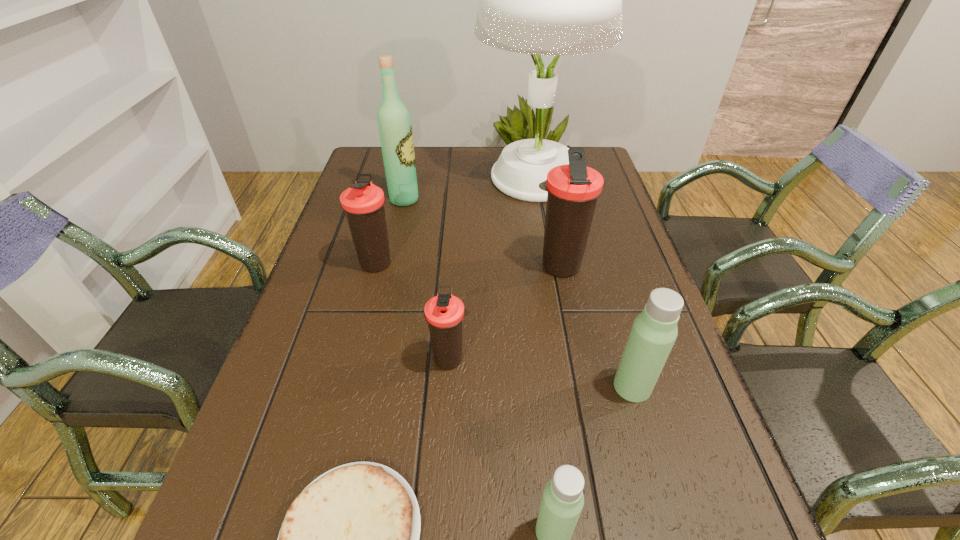
At what (x,y) coordinates should I click in order to perform the action: click on the tallest object. Please return your answer as a coordinate pair (x, y). Image resolution: width=960 pixels, height=540 pixels. Looking at the image, I should click on (556, 0).

You are a GUI agent. You are given a task and a screenshot of the screen. Output one action in this format:
    pyautogui.click(x=<x>, y=<y>)
    Task: Click on the lamp
    The image size is (960, 540).
    Given the screenshot: What is the action you would take?
    pyautogui.click(x=556, y=0)

Identify the location of the seventh shortest object. The width and height of the screenshot is (960, 540). (395, 129).

Find the location of a particular element. The width and height of the screenshot is (960, 540). white wine bottle is located at coordinates (395, 129).

The image size is (960, 540). Find the location of `the sixth shortest object`. the sixth shortest object is located at coordinates (573, 189).

The width and height of the screenshot is (960, 540). I want to click on the biggest brown thermos bottle, so click(x=573, y=189).

Locate an element on the screen. The width and height of the screenshot is (960, 540). the leftmost thermos bottle is located at coordinates (363, 202).

Locate an element on the screen. Image resolution: width=960 pixels, height=540 pixels. the leftmost brown thermos bottle is located at coordinates (363, 202).

The image size is (960, 540). Find the location of `the bigger light thermos bottle`. the bigger light thermos bottle is located at coordinates (654, 331).

The height and width of the screenshot is (540, 960). I want to click on the farther light thermos bottle, so click(x=654, y=331).